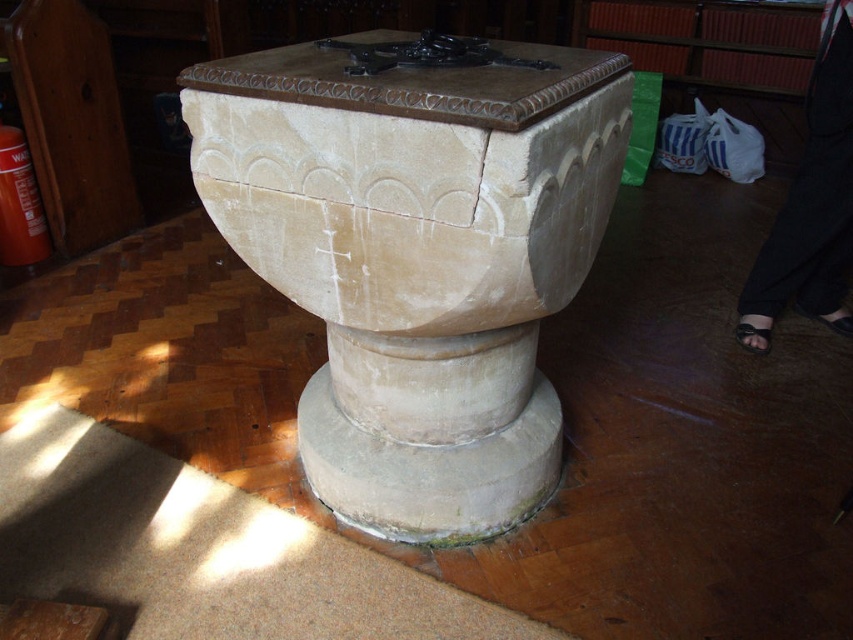
You are an interior designer planning to place a 10 cm thick decorative stone plaque between the beige stone baptismal font at center and the white stone pedestal at center. Based on their thickness, which object should the plaque be placed against to ensure it fits properly?

The beige stone baptismal font at center is thinner than the white stone pedestal at center, so the plaque should be placed against the white stone pedestal at center since it has a thicker structure to support the plaque.

You are a church caretaker who needs to move the beige stone baptismal font at center and the white stone pedestal at center to a storage room. The storage room has a height restriction of 1.5 meters. Can both items be moved through the doorway without being disassembled?

The beige stone baptismal font at center has a larger size compared to white stone pedestal at center. Since the beige stone baptismal font at center is larger, it is possible that its height exceeds the 1.5 meter restriction. However, without specific height measurements, we cannot confirm if both items can pass through the doorway. Please measure the height of both items before moving them.